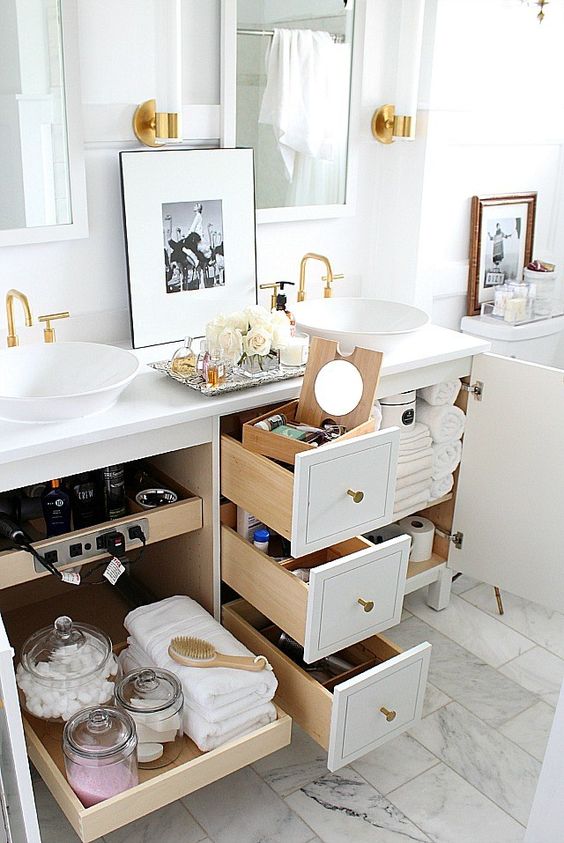
At what (x,y) coordinates should I click in order to perform the action: click on mirror. Please return your answer as a coordinate pair (x, y). The height and width of the screenshot is (843, 564). Looking at the image, I should click on [x=38, y=79], [x=258, y=67], [x=342, y=383].